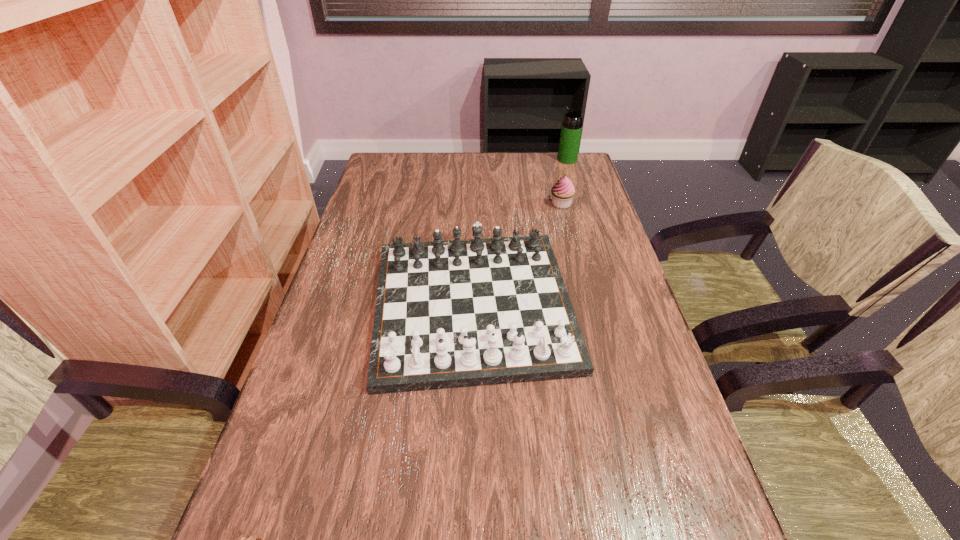
Locate an element on the screen. This screenshot has height=540, width=960. vacant region between the chessboard and the farthest object is located at coordinates coord(520,233).

You are a GUI agent. You are given a task and a screenshot of the screen. Output one action in this format:
    pyautogui.click(x=<x>, y=<y>)
    Task: Click on the empty space that is in between the tallest object and the second nearest object
    This screenshot has height=540, width=960.
    Given the screenshot: What is the action you would take?
    pyautogui.click(x=520, y=233)

Identify the location of free space between the chessboard and the thermos bottle. (520, 233).

Find the location of a particular element. This screenshot has width=960, height=540. empty location between the second nearest object and the farthest object is located at coordinates pyautogui.click(x=520, y=233).

Select which object is the second closest to the nearest object. Please provide its 2D coordinates. Your answer should be formatted as a tuple, i.e. [(x, y)], where the tuple contains the x and y coordinates of a point satisfying the conditions above.

[(563, 191)]

Locate which object is the third closest to the nearest object. Please provide its 2D coordinates. Your answer should be formatted as a tuple, i.e. [(x, y)], where the tuple contains the x and y coordinates of a point satisfying the conditions above.

[(571, 128)]

Find the location of `vacant space that satisfies the following two spatial constraints: 1. on the back side of the chessboard; 2. on the right side of the second farthest object`. vacant space that satisfies the following two spatial constraints: 1. on the back side of the chessboard; 2. on the right side of the second farthest object is located at coordinates (474, 204).

Locate an element on the screen. vacant area in the image that satisfies the following two spatial constraints: 1. from the spout of the farthest object; 2. on the front side of the second farthest object is located at coordinates (581, 204).